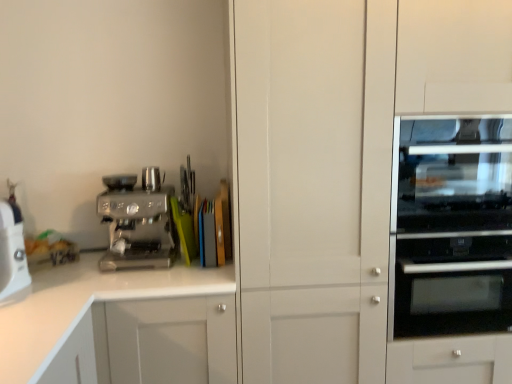
Question: Is black glass oven at right positioned with its back to satin chrome espresso machine at left?

Choices:
 (A) yes
 (B) no

Answer: (B)

Question: Is black glass oven at right not close to satin chrome espresso machine at left?

Choices:
 (A) no
 (B) yes

Answer: (B)

Question: Is black glass oven at right completely or partially outside of satin chrome espresso machine at left?

Choices:
 (A) yes
 (B) no

Answer: (A)

Question: Can you confirm if black glass oven at right is bigger than satin chrome espresso machine at left?

Choices:
 (A) yes
 (B) no

Answer: (A)

Question: From the image's perspective, is black glass oven at right on top of satin chrome espresso machine at left?

Choices:
 (A) no
 (B) yes

Answer: (A)

Question: Can you confirm if black glass oven at right is thinner than satin chrome espresso machine at left?

Choices:
 (A) yes
 (B) no

Answer: (B)

Question: Is satin chrome espresso machine at left facing away from black glass oven at right?

Choices:
 (A) yes
 (B) no

Answer: (B)

Question: Considering the relative positions of satin chrome espresso machine at left and black glass oven at right in the image provided, is satin chrome espresso machine at left to the left of black glass oven at right from the viewer's perspective?

Choices:
 (A) yes
 (B) no

Answer: (A)

Question: Can you confirm if satin chrome espresso machine at left is bigger than black glass oven at right?

Choices:
 (A) yes
 (B) no

Answer: (B)

Question: From the image's perspective, is satin chrome espresso machine at left on top of black glass oven at right?

Choices:
 (A) no
 (B) yes

Answer: (B)

Question: Considering the relative positions of satin chrome espresso machine at left and black glass oven at right in the image provided, is satin chrome espresso machine at left in front of black glass oven at right?

Choices:
 (A) no
 (B) yes

Answer: (A)

Question: Does satin chrome espresso machine at left appear on the right side of black glass oven at right?

Choices:
 (A) yes
 (B) no

Answer: (B)

Question: Considering the relative sizes of satin chrome espresso machine at left and transparent glass oven at right in the image provided, is satin chrome espresso machine at left bigger than transparent glass oven at right?

Choices:
 (A) yes
 (B) no

Answer: (B)